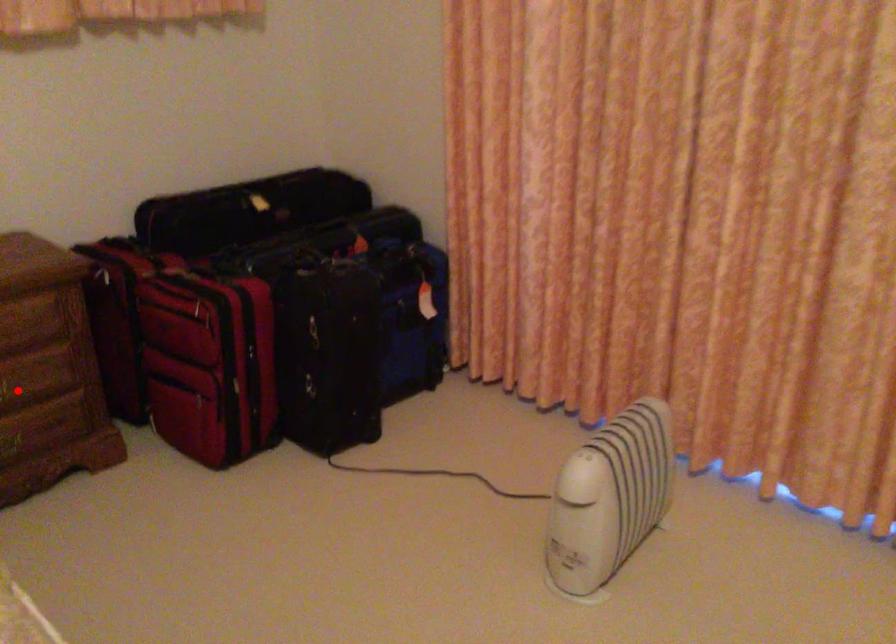
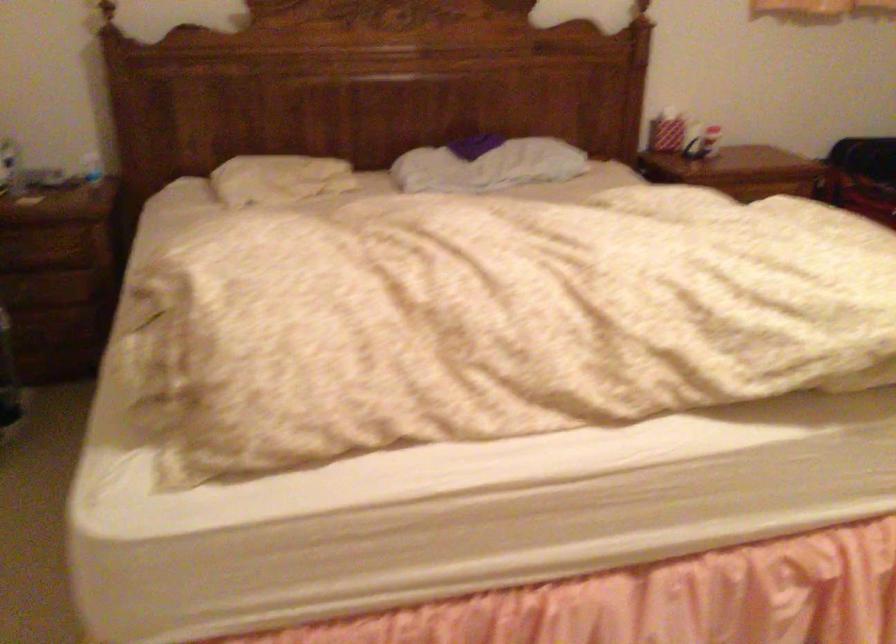
Question: I am providing you with two images of the same scene from different viewpoints. A red point is marked on the first image. At the location where the point appears in image 1, is it still visible in image 2?

Choices:
 (A) Yes
 (B) No

Answer: (B)